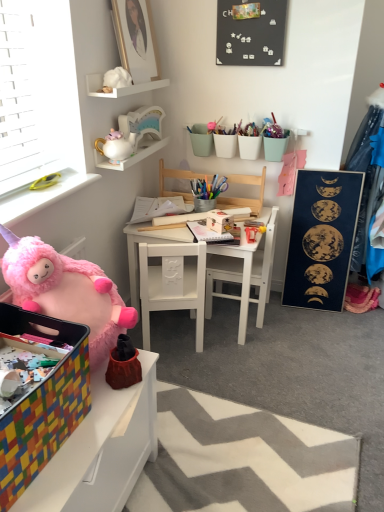
Question: Is black matte board at upper center, which is the first bulletin board in left-to-right order, at the back of white glossy teapot at upper center, the second toy ordered from the bottom?

Choices:
 (A) no
 (B) yes

Answer: (A)

Question: From a real-world perspective, is white glossy teapot at upper center, the 2th toy when ordered from top to bottom, on top of black matte board at upper center, the second bulletin board viewed from the right?

Choices:
 (A) yes
 (B) no

Answer: (B)

Question: Is white glossy teapot at upper center, acting as the first toy starting from the back, oriented towards black matte board at upper center, which is the first bulletin board in left-to-right order?

Choices:
 (A) yes
 (B) no

Answer: (B)

Question: Is white glossy teapot at upper center, acting as the first toy starting from the back, located outside black matte board at upper center, which ranks as the 2th bulletin board in bottom-to-top order?

Choices:
 (A) yes
 (B) no

Answer: (A)

Question: Can you confirm if white glossy teapot at upper center, the 2th toy when ordered from top to bottom, is bigger than black matte board at upper center, which ranks as the 2th bulletin board in bottom-to-top order?

Choices:
 (A) no
 (B) yes

Answer: (A)

Question: From the image's perspective, is white glossy teapot at upper center, the 2th toy when ordered from top to bottom, above or below white ceramic teapot at upper left, the 2th shelf in the top-to-bottom sequence?

Choices:
 (A) above
 (B) below

Answer: (B)

Question: From a real-world perspective, is white glossy teapot at upper center, the second toy ordered from the bottom, positioned above or below white ceramic teapot at upper left, acting as the 1th shelf starting from the bottom?

Choices:
 (A) above
 (B) below

Answer: (A)

Question: Considering their positions, is white glossy teapot at upper center, the second toy ordered from the bottom, located in front of or behind white ceramic teapot at upper left, acting as the 1th shelf starting from the bottom?

Choices:
 (A) behind
 (B) front

Answer: (B)

Question: From their relative heights in the image, would you say white glossy teapot at upper center, the second toy ordered from the bottom, is taller or shorter than white ceramic teapot at upper left, the 2th shelf in the top-to-bottom sequence?

Choices:
 (A) short
 (B) tall

Answer: (B)

Question: In the image, is white matte shelf at upper center, placed as the first shelf when sorted from top to bottom, on the left side or the right side of white ceramic teapot at upper left, acting as the 1th shelf starting from the bottom?

Choices:
 (A) left
 (B) right

Answer: (B)

Question: From the image's perspective, is white matte shelf at upper center, placed as the first shelf when sorted from top to bottom, positioned above or below white ceramic teapot at upper left, the 2th shelf in the top-to-bottom sequence?

Choices:
 (A) above
 (B) below

Answer: (A)

Question: Is white matte shelf at upper center, placed as the first shelf when sorted from top to bottom, bigger or smaller than white ceramic teapot at upper left, acting as the 1th shelf starting from the bottom?

Choices:
 (A) small
 (B) big

Answer: (A)

Question: Considering the positions of white matte shelf at upper center, the 2th shelf from the bottom, and white ceramic teapot at upper left, the 2th shelf in the top-to-bottom sequence, in the image, is white matte shelf at upper center, the 2th shelf from the bottom, wider or thinner than white ceramic teapot at upper left, the 2th shelf in the top-to-bottom sequence,?

Choices:
 (A) wide
 (B) thin

Answer: (B)

Question: Is white matte shelf at upper center, placed as the first shelf when sorted from top to bottom, wider or thinner than white matte table at center, the 1th table positioned from the top?

Choices:
 (A) wide
 (B) thin

Answer: (B)

Question: Does point (87, 79) appear closer or farther from the camera than point (261, 212)?

Choices:
 (A) closer
 (B) farther

Answer: (A)